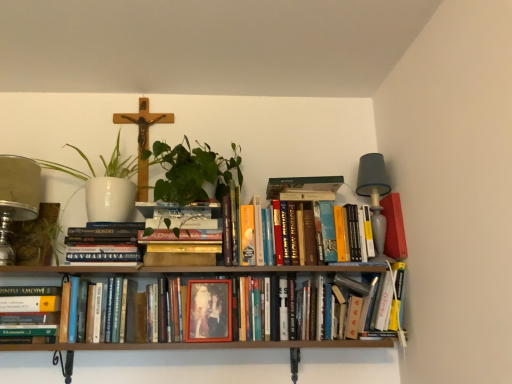
Locate an element on the screen. The image size is (512, 384). vacant space situated on the left part of matte red paperback book at right, positioned as the 2th paperback book in left-to-right order is located at coordinates (357, 274).